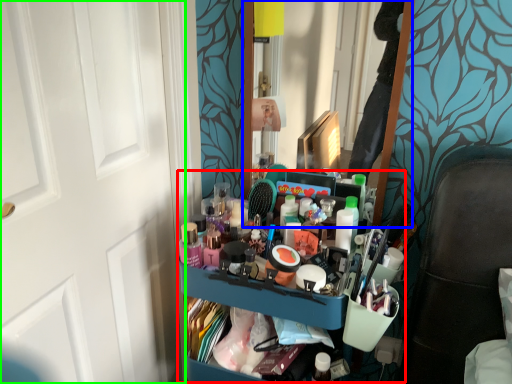
Question: Estimate the real-world distances between objects in this image. Which object is farther from bookshelf (highlighted by a red box), mirror (highlighted by a blue box) or door (highlighted by a green box)?

Choices:
 (A) mirror
 (B) door

Answer: (A)